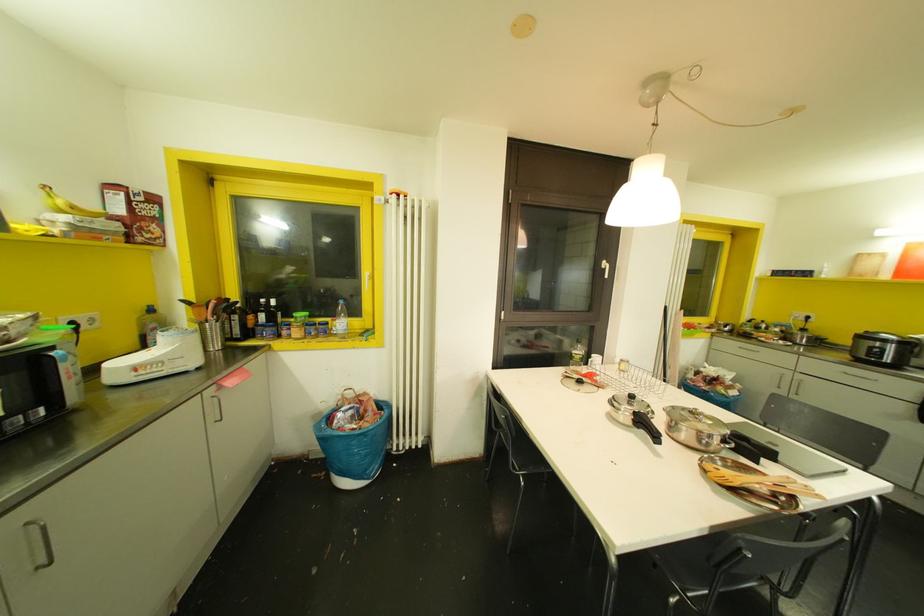
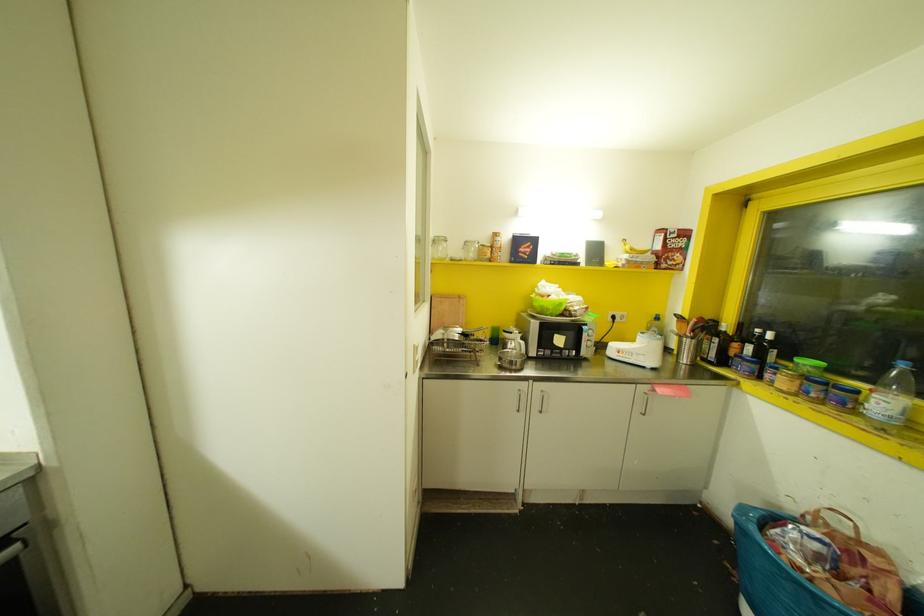
The point at (249, 315) is marked in the first image. Where is the corresponding point in the second image?

(735, 345)